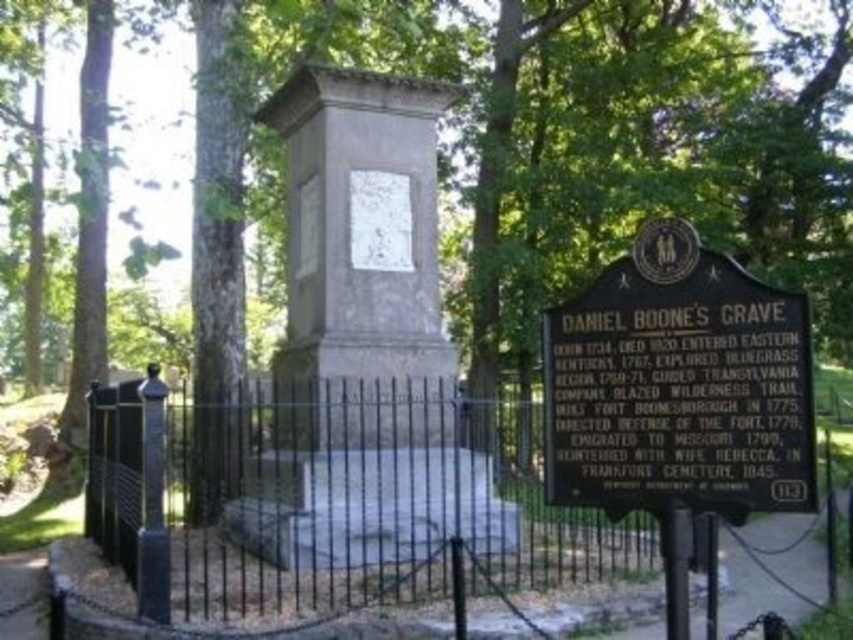
You are standing in front of Daniel Boone grave site and want to take a photo of both the gray stone monument at center and the black polished stone sign at center. Which object should you position to your left to include both in the frame?

You should position the gray stone monument at center to your left since it is located to the left of the black polished stone sign at center, allowing both to be captured in the photo.

You are a tourist standing in front of Daniel Boone grave site. You see the gray stone monument at center and the black polished stone sign at center. Which object is closer to you?

The gray stone monument at center is closer to you than the black polished stone sign at center.

You are standing at the center of Daniel Boone grave site and want to take a photo that includes both the monument and the historical marker sign. Which point, point at (345,508) or point at (804,305), is closer to the camera to ensure both objects are in frame?

Point at (345,508) is closer to the camera than point at (804,305), so focusing on that point will help include both the monument and the historical marker sign in the photo.